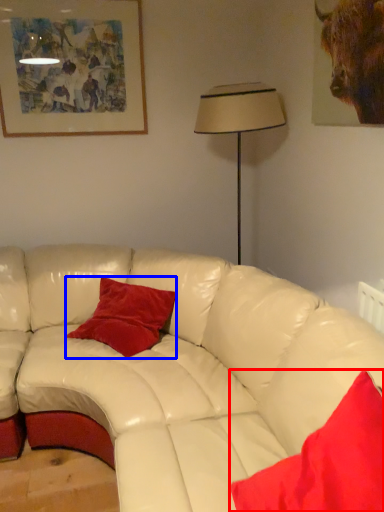
Question: Which object appears farthest to the camera in this image, pillow (highlighted by a red box) or pillow (highlighted by a blue box)?

Choices:
 (A) pillow
 (B) pillow

Answer: (B)